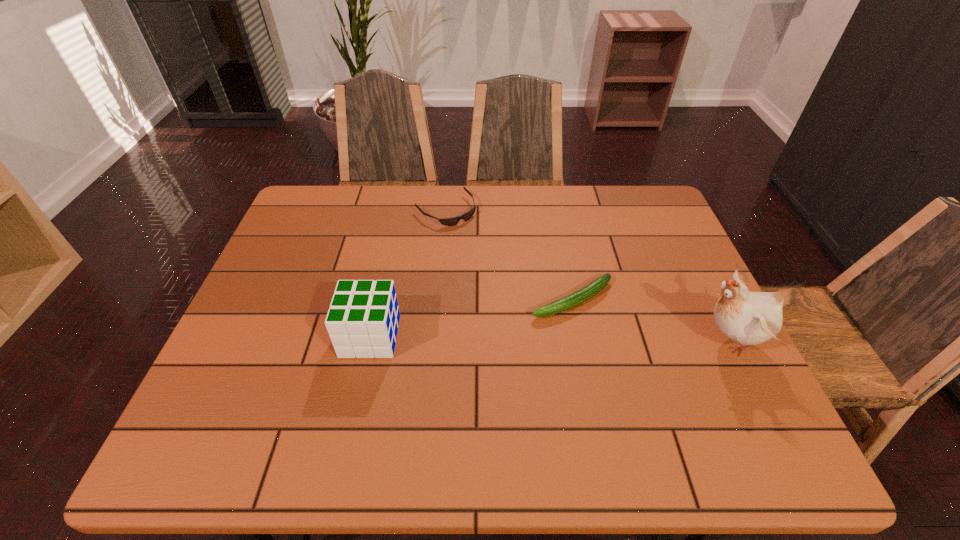
This screenshot has width=960, height=540. Identify the location of object situated at the right edge. (748, 318).

Image resolution: width=960 pixels, height=540 pixels. I want to click on object that is at the near right corner, so click(x=748, y=318).

Where is `vacant region at the far edge of the desktop`? The height and width of the screenshot is (540, 960). vacant region at the far edge of the desktop is located at coordinates (493, 198).

Image resolution: width=960 pixels, height=540 pixels. What are the coordinates of `free region at the near edge` in the screenshot? It's located at (448, 406).

The width and height of the screenshot is (960, 540). In the image, there is a desktop. What are the coordinates of `free space at the left edge` in the screenshot? It's located at (246, 328).

In the image, there is a desktop. What are the coordinates of `vacant space at the right edge` in the screenshot? It's located at (666, 254).

Find the location of a particular element. The height and width of the screenshot is (540, 960). vacant region at the far left corner of the desktop is located at coordinates (307, 197).

You are a GUI agent. You are given a task and a screenshot of the screen. Output one action in this format:
    pyautogui.click(x=<x>, y=<y>)
    Task: Click on the blank space at the near left corner
    
    Given the screenshot: What is the action you would take?
    pyautogui.click(x=281, y=387)

Where is `vacant point located between the farthest object and the second object from right to left`? The height and width of the screenshot is (540, 960). vacant point located between the farthest object and the second object from right to left is located at coordinates (509, 254).

Where is `free space between the zucchini and the tallest object`? free space between the zucchini and the tallest object is located at coordinates (651, 319).